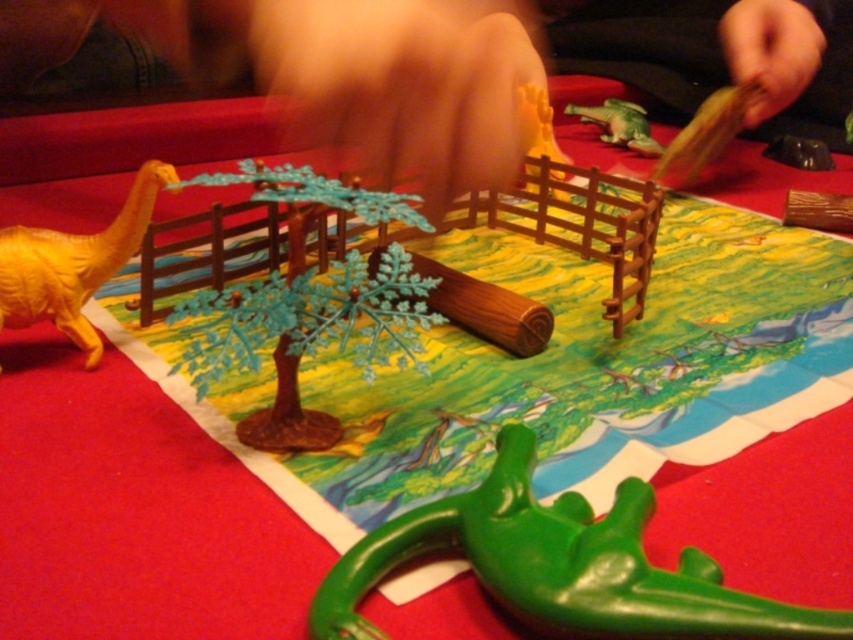
Question: Is green plastic dinosaur at lower center smaller than green plastic crocodile at upper right?

Choices:
 (A) no
 (B) yes

Answer: (A)

Question: Can you confirm if yellow matte dinosaur at left is thinner than green plastic crocodile at upper right?

Choices:
 (A) no
 (B) yes

Answer: (A)

Question: Which object is closer to the camera taking this photo?

Choices:
 (A) green plastic crocodile at upper right
 (B) yellow matte dinosaur at left

Answer: (B)

Question: Considering the real-world distances, which object is farthest from the green plastic dinosaur at lower center?

Choices:
 (A) yellow matte dinosaur at left
 (B) green plastic crocodile at upper right

Answer: (B)

Question: Which point is closer to the camera taking this photo?

Choices:
 (A) (612, 140)
 (B) (71, 250)
 (C) (676, 627)

Answer: (C)

Question: Can you confirm if green plastic dinosaur at lower center is positioned to the right of green plastic crocodile at upper right?

Choices:
 (A) no
 (B) yes

Answer: (A)